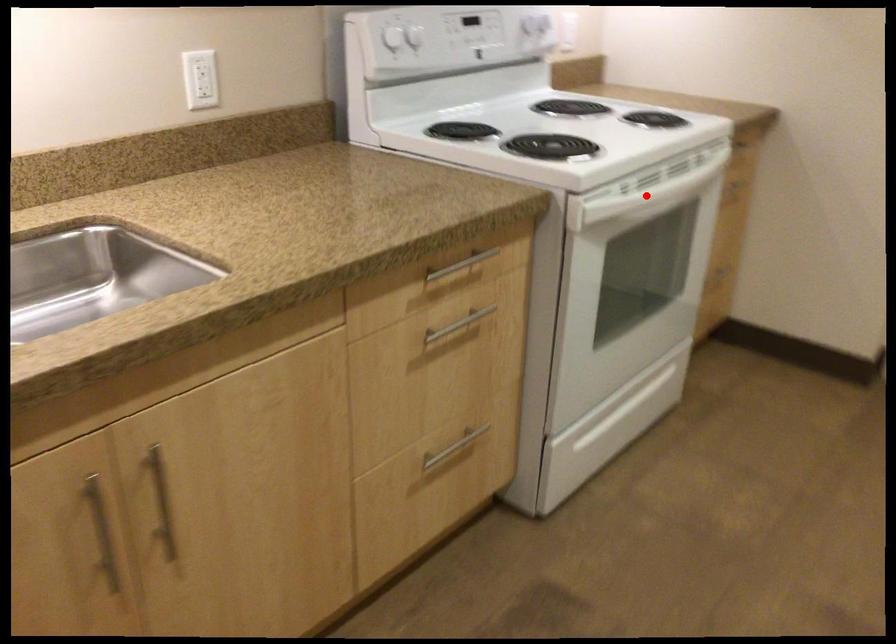
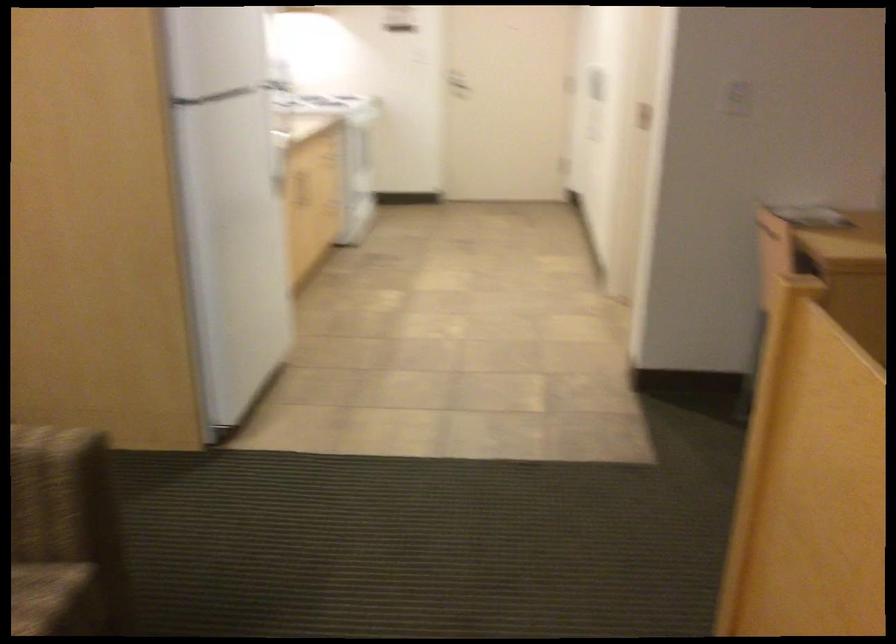
Question: I am providing you with two images of the same scene from different viewpoints. A red point is marked on the first image. At the location where the point appears in image 1, is it still visible in image 2?

Choices:
 (A) Yes
 (B) No

Answer: (B)